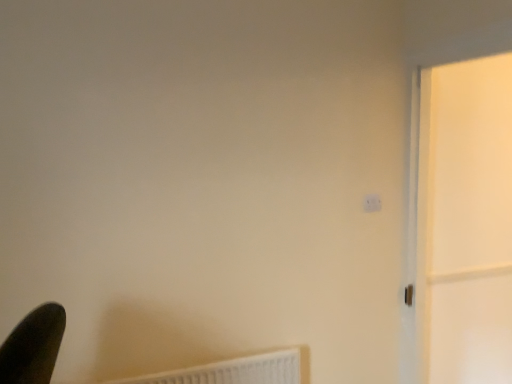
Question: Is the depth of white plastic radiator at lower left greater than that of white plastic light switch at upper right?

Choices:
 (A) no
 (B) yes

Answer: (A)

Question: Considering the relative positions of white plastic radiator at lower left and white plastic light switch at upper right in the image provided, is white plastic radiator at lower left to the right of white plastic light switch at upper right from the viewer's perspective?

Choices:
 (A) yes
 (B) no

Answer: (B)

Question: Can you confirm if white plastic radiator at lower left is thinner than white plastic light switch at upper right?

Choices:
 (A) yes
 (B) no

Answer: (B)

Question: Is white plastic radiator at lower left at the left side of white plastic light switch at upper right?

Choices:
 (A) yes
 (B) no

Answer: (A)

Question: From the image's perspective, would you say white plastic radiator at lower left is positioned over white plastic light switch at upper right?

Choices:
 (A) no
 (B) yes

Answer: (A)

Question: Is white plastic radiator at lower left inside or outside of white glossy screen door at right?

Choices:
 (A) inside
 (B) outside

Answer: (B)

Question: In terms of width, does white plastic radiator at lower left look wider or thinner when compared to white glossy screen door at right?

Choices:
 (A) wide
 (B) thin

Answer: (B)

Question: Considering their positions, is white plastic radiator at lower left located in front of or behind white glossy screen door at right?

Choices:
 (A) front
 (B) behind

Answer: (B)

Question: In terms of size, does white plastic radiator at lower left appear bigger or smaller than white glossy screen door at right?

Choices:
 (A) big
 (B) small

Answer: (B)

Question: Looking at their shapes, would you say white glossy screen door at right is wider or thinner than white plastic light switch at upper right?

Choices:
 (A) wide
 (B) thin

Answer: (A)

Question: Do you think white glossy screen door at right is within white plastic light switch at upper right, or outside of it?

Choices:
 (A) outside
 (B) inside

Answer: (A)

Question: Is white glossy screen door at right bigger or smaller than white plastic light switch at upper right?

Choices:
 (A) big
 (B) small

Answer: (A)

Question: From a real-world perspective, is white glossy screen door at right physically located above or below white plastic light switch at upper right?

Choices:
 (A) above
 (B) below

Answer: (B)

Question: Does point (117, 380) appear closer or farther from the camera than point (378, 198)?

Choices:
 (A) closer
 (B) farther

Answer: (A)

Question: Based on their positions, is white plastic radiator at lower left located to the left or right of white plastic light switch at upper right?

Choices:
 (A) right
 (B) left

Answer: (B)